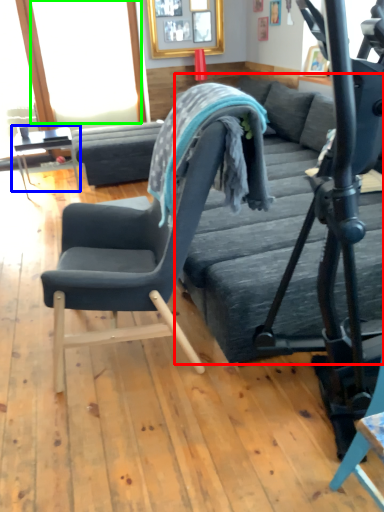
Question: Estimate the real-world distances between objects in this image. Which object is farther from bed frame (highlighted by a red box), table (highlighted by a blue box) or window screen (highlighted by a green box)?

Choices:
 (A) table
 (B) window screen

Answer: (B)